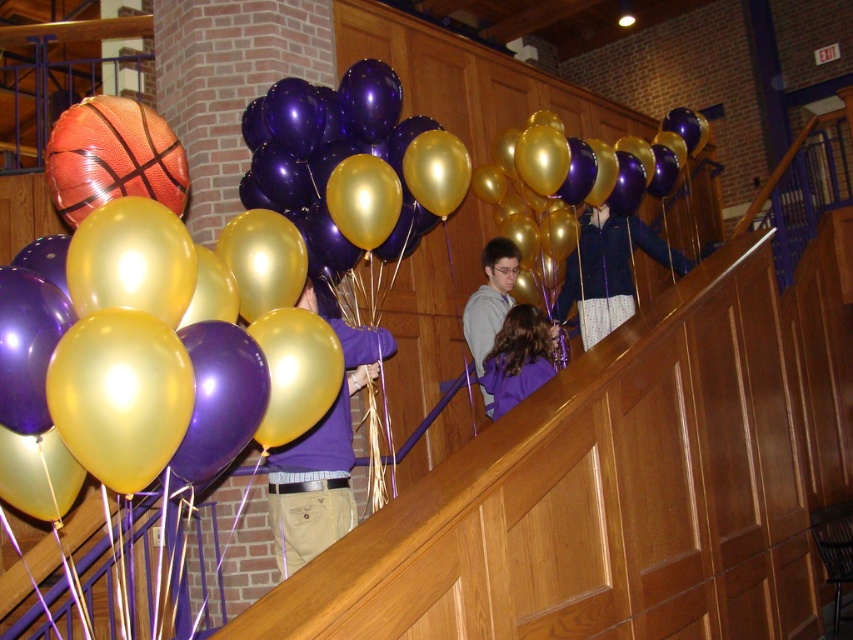
Question: Can you confirm if metallic gold balloon at center is bigger than purple matte shirt at center?

Choices:
 (A) yes
 (B) no

Answer: (A)

Question: Which point is farther to the camera?

Choices:
 (A) 550,330
 (B) 561,321
 (C) 633,276
 (D) 328,452

Answer: (C)

Question: Where is purple matte shirt at center located in relation to matte purple jacket at center in the image?

Choices:
 (A) left
 (B) right

Answer: (A)

Question: Which point is closer to the camera?

Choices:
 (A) matte purple jacket at center
 (B) dark blue jacket at upper right
 (C) metallic gold balloon at center

Answer: (A)

Question: Which object is farther from the camera taking this photo?

Choices:
 (A) metallic gold balloon at center
 (B) purple matte shirt at center

Answer: (A)

Question: Is purple matte shirt at center wider than dark blue jacket at upper right?

Choices:
 (A) no
 (B) yes

Answer: (A)